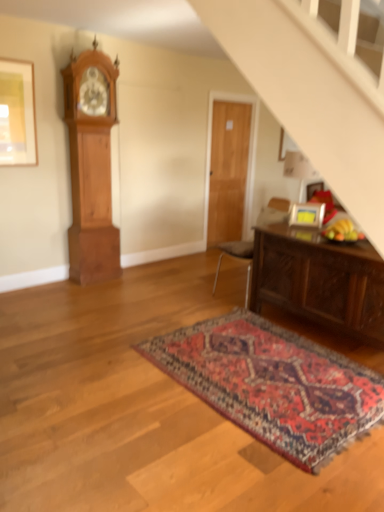
This screenshot has width=384, height=512. Find the location of `vacant region above carpeted rug at center (from a real-world perspective)`. vacant region above carpeted rug at center (from a real-world perspective) is located at coordinates (268, 365).